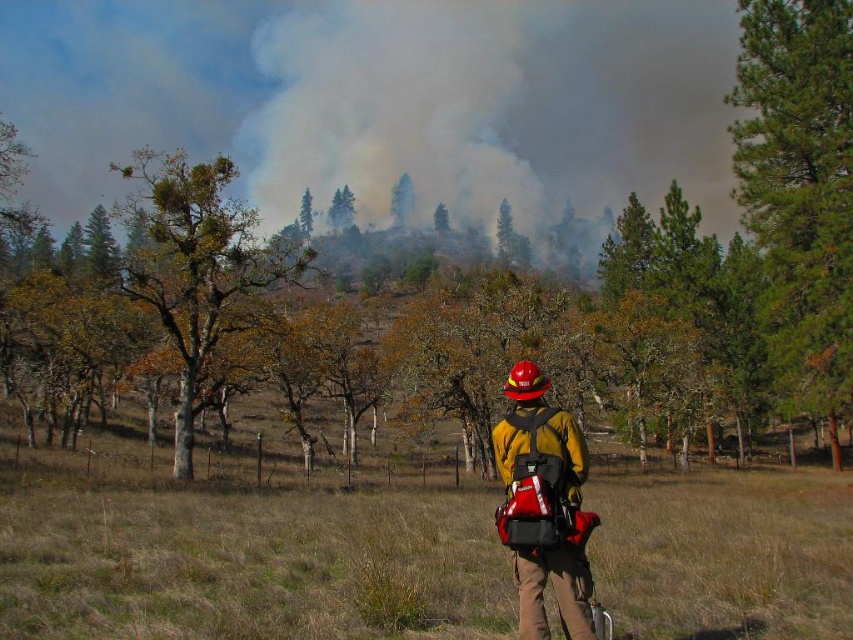
Which is behind, point (746, 83) or point (309, 205)?

The point (309, 205) is behind.

Between green pine tree at right and green matte tree at upper center, which one appears on the left side from the viewer's perspective?

green matte tree at upper center

Is point (804, 336) closer to viewer compared to point (311, 220)?

Yes.

This screenshot has height=640, width=853. Identify the location of green pine tree at right. (799, 186).

Measure the distance between green leafy tree at left and green matte tree at upper center.

A distance of 41.76 meters exists between green leafy tree at left and green matte tree at upper center.

In the scene shown: Measure the distance from green leafy tree at left to green matte tree at upper center.

They are 41.76 meters apart.

Which is in front, point (181, 236) or point (306, 234)?

Point (181, 236) is more forward.

At what (x,y) coordinates should I click in order to perform the action: click on green leafy tree at left. Please return your answer as a coordinate pair (x, y). This screenshot has width=853, height=640. Looking at the image, I should click on (196, 268).

Who is lower down, green pine tree at right or yellow matte fireman at center?

yellow matte fireman at center

Who is positioned more to the right, green pine tree at right or yellow matte fireman at center?

green pine tree at right

Does point (848, 3) come closer to viewer compared to point (585, 588)?

That is False.

The image size is (853, 640). In order to click on green pine tree at right in this screenshot , I will do `click(799, 186)`.